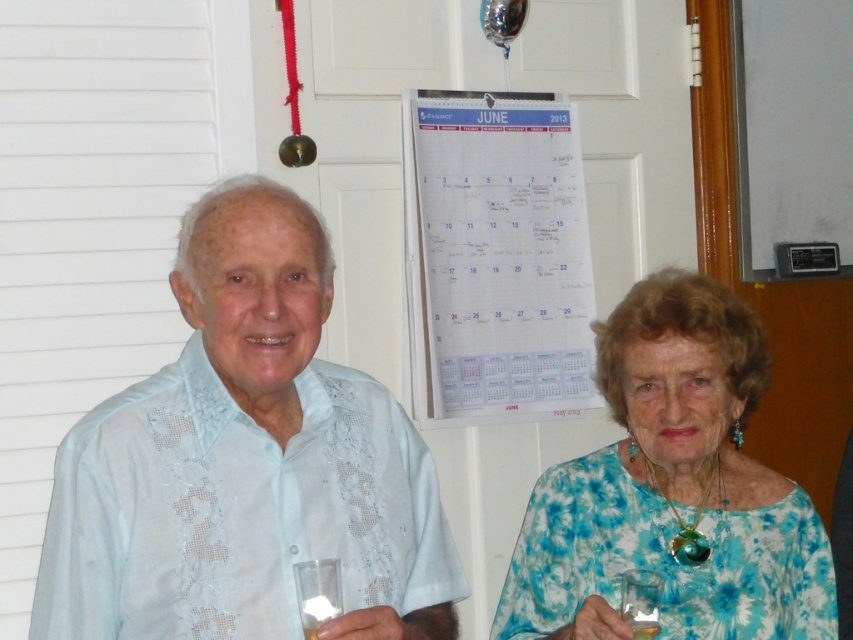
You are at a social event and need to hand a document to both the person wearing the light blue fabric shirt at center and the person wearing the blue floral dress at center. Since you can only approach one at a time, which one should you approach first based on their position?

The light blue fabric shirt at center is positioned over the blue floral dress at center, so you should approach the light blue fabric shirt at center first as it is closer to you.